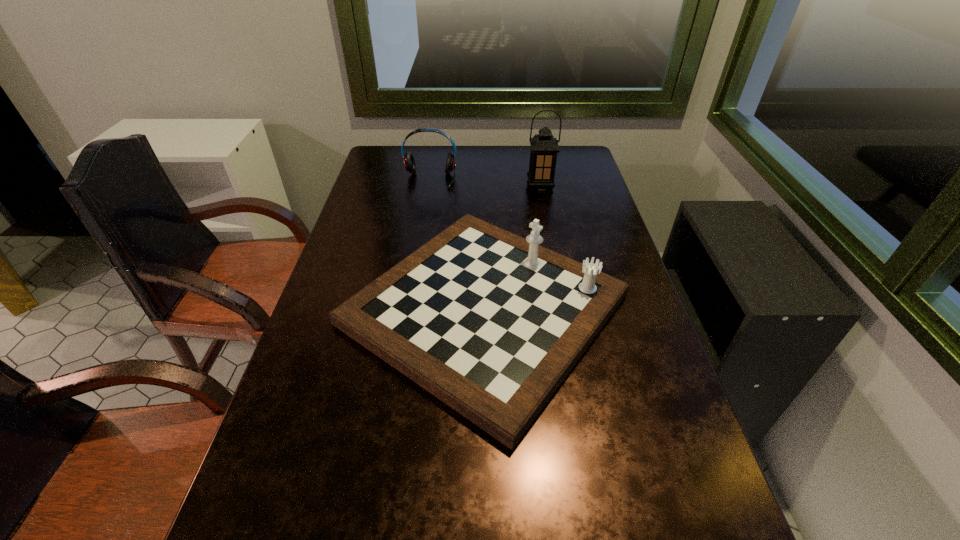
This screenshot has height=540, width=960. Find the location of `free region that satisfies the following two spatial constraints: 1. with the microphone attached to the side of the tallest object; 2. on the right side of the headset`. free region that satisfies the following two spatial constraints: 1. with the microphone attached to the side of the tallest object; 2. on the right side of the headset is located at coordinates (428, 187).

Find the location of a particular element. This screenshot has height=540, width=960. vacant point that satisfies the following two spatial constraints: 1. with the microphone attached to the side of the tallest object; 2. on the right side of the headset is located at coordinates (428, 187).